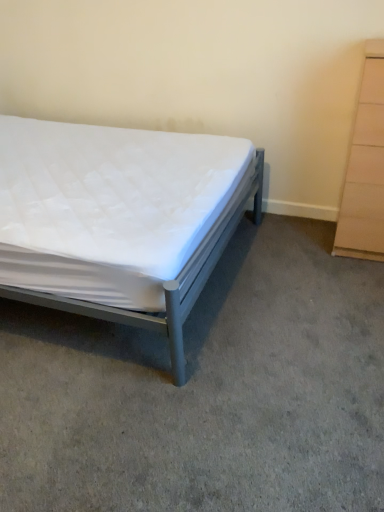
Question: Looking at their shapes, would you say white quilted mattress at center is wider or thinner than metallic gray bed at left?

Choices:
 (A) thin
 (B) wide

Answer: (B)

Question: Would you say white quilted mattress at center is inside or outside metallic gray bed at left?

Choices:
 (A) inside
 (B) outside

Answer: (B)

Question: Estimate the real-world distances between objects in this image. Which object is farther from the beige wood chest of drawers at right?

Choices:
 (A) metallic gray bed at left
 (B) white quilted mattress at center

Answer: (A)

Question: Considering the real-world distances, which object is closest to the metallic gray bed at left?

Choices:
 (A) white quilted mattress at center
 (B) beige wood chest of drawers at right

Answer: (A)